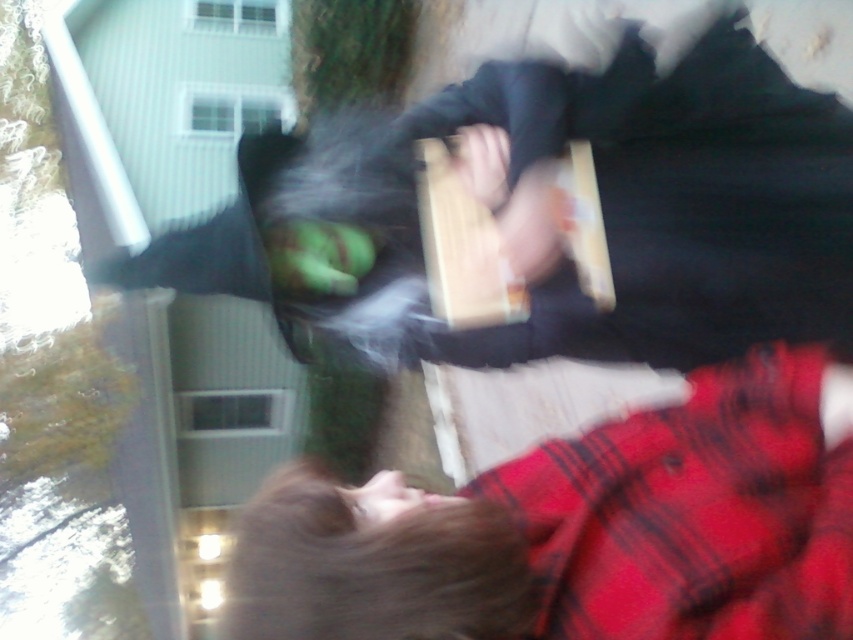
You are standing in a room and see the matte black jacket at upper center and the flannel shirt at lower right. Which object is located to the left of the other?

The matte black jacket at upper center is positioned on the left side of flannel shirt at lower right.

You are a photographer trying to capture a clear image of both the matte black jacket at upper center and the flannel shirt at lower right. Given that the current photo is slightly blurred due to motion, which object should you focus on to ensure clarity, considering their sizes?

The matte black jacket at upper center is larger in size than the flannel shirt at lower right, so focusing on the matte black jacket at upper center would provide a clearer image due to its larger size making it easier to capture without motion blur.

You are a photographer trying to capture a clear shot of the matte black jacket at upper center and the flannel shirt at lower right. Given that the image is slightly blurred, which object would you adjust your focus on first to ensure both are clear, considering their sizes?

The matte black jacket at upper center is wider than the flannel shirt at lower right. To ensure both are clear, focus on the wider matte black jacket at upper center first, as it requires more precise focus due to its larger size.